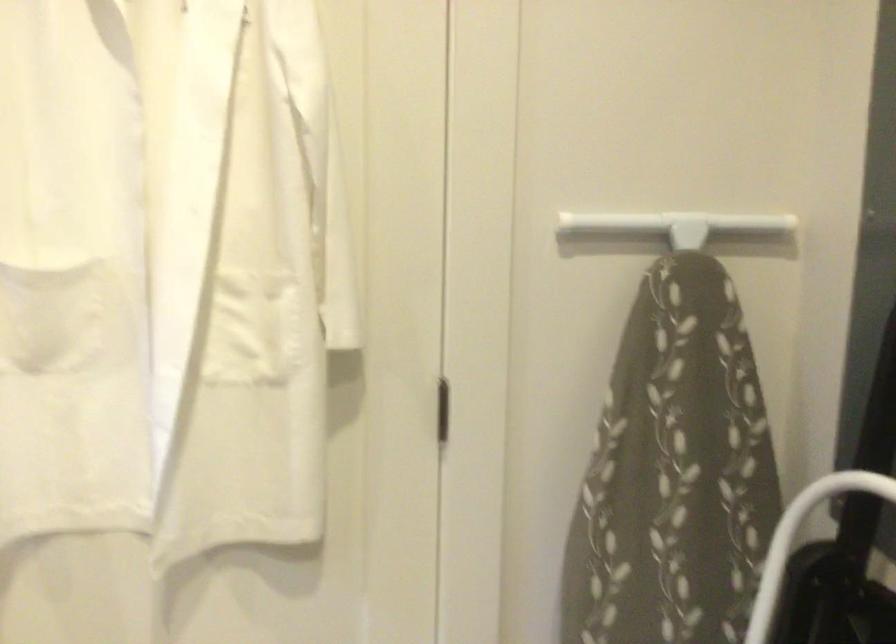
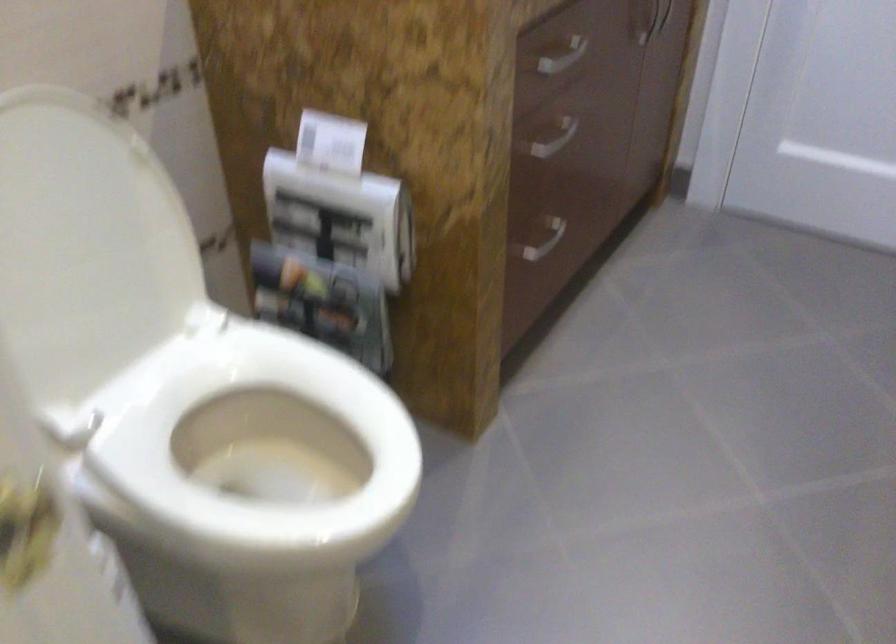
The first image is from the beginning of the video and the second image is from the end. How did the camera likely rotate when shooting the video?

The rotation direction of the camera is right-down.